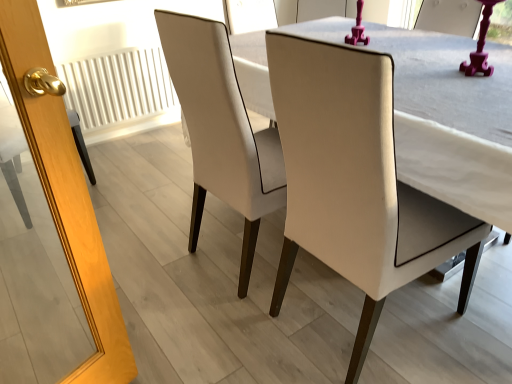
Question: Is white leather chair at center, arranged as the first chair when viewed from the left, in contact with matte white chair at center, which is counted as the 2th chair, starting from the left?

Choices:
 (A) yes
 (B) no

Answer: (B)

Question: From the image's perspective, does white leather chair at center, arranged as the first chair when viewed from the left, appear higher than matte white chair at center, which is counted as the 2th chair, starting from the left?

Choices:
 (A) yes
 (B) no

Answer: (B)

Question: Can you confirm if white leather chair at center, which is the 2th chair in right-to-left order, is thinner than matte white chair at center, which is counted as the 2th chair, starting from the left?

Choices:
 (A) no
 (B) yes

Answer: (B)

Question: Is white leather chair at center, which is the 2th chair in right-to-left order, shorter than matte white chair at center, the 1th chair in the right-to-left sequence?

Choices:
 (A) yes
 (B) no

Answer: (B)

Question: Can you confirm if white leather chair at center, arranged as the first chair when viewed from the left, is positioned to the right of matte white chair at center, the 1th chair in the right-to-left sequence?

Choices:
 (A) no
 (B) yes

Answer: (A)

Question: From a real-world perspective, is white leather chair at center, which is the 2th chair in right-to-left order, physically below matte white chair at center, the 1th chair in the right-to-left sequence?

Choices:
 (A) no
 (B) yes

Answer: (A)

Question: Is matte white chair at center, the 1th chair in the right-to-left sequence, not near white leather chair at center, arranged as the first chair when viewed from the left?

Choices:
 (A) yes
 (B) no

Answer: (B)

Question: Considering the relative positions of matte white chair at center, the 1th chair in the right-to-left sequence, and white leather chair at center, which is the 2th chair in right-to-left order, in the image provided, is matte white chair at center, the 1th chair in the right-to-left sequence, to the right of white leather chair at center, which is the 2th chair in right-to-left order, from the viewer's perspective?

Choices:
 (A) yes
 (B) no

Answer: (A)

Question: Does matte white chair at center, the 1th chair in the right-to-left sequence, have a smaller size compared to white leather chair at center, arranged as the first chair when viewed from the left?

Choices:
 (A) no
 (B) yes

Answer: (A)

Question: Is matte white chair at center, which is counted as the 2th chair, starting from the left, behind white leather chair at center, which is the 2th chair in right-to-left order?

Choices:
 (A) yes
 (B) no

Answer: (B)

Question: Is matte white chair at center, which is counted as the 2th chair, starting from the left, completely or partially outside of white leather chair at center, which is the 2th chair in right-to-left order?

Choices:
 (A) yes
 (B) no

Answer: (A)

Question: Is matte white chair at center, which is counted as the 2th chair, starting from the left, bigger than white leather chair at center, which is the 2th chair in right-to-left order?

Choices:
 (A) yes
 (B) no

Answer: (A)

Question: Can we say white textured radiator at left lies outside matte white chair at center, the 1th chair in the right-to-left sequence?

Choices:
 (A) yes
 (B) no

Answer: (A)